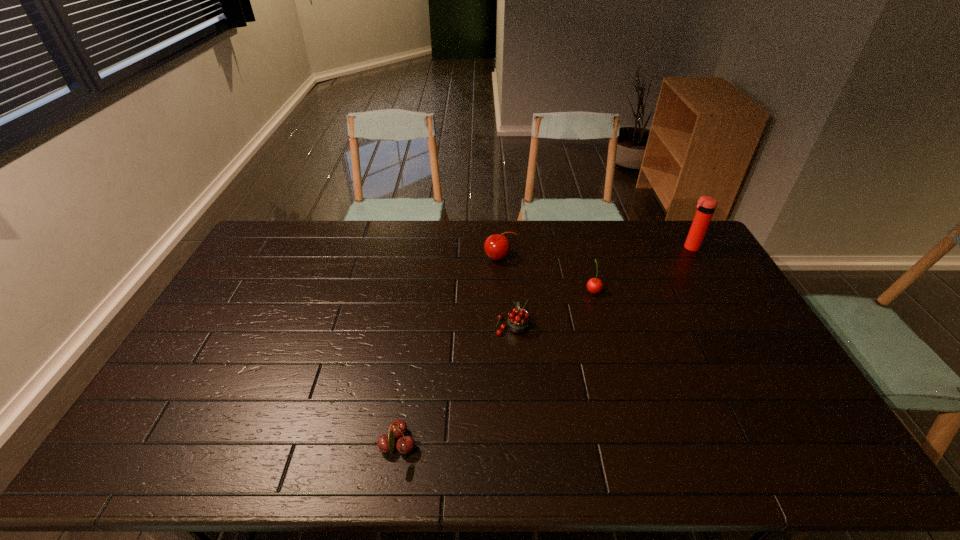
Identify the location of the rightmost object. The image size is (960, 540). (706, 205).

Locate an element on the screen. This screenshot has width=960, height=540. the tallest object is located at coordinates (706, 205).

You are a GUI agent. You are given a task and a screenshot of the screen. Output one action in this format:
    pyautogui.click(x=<x>, y=<y>)
    Task: Click on the farthest cherry
    
    Given the screenshot: What is the action you would take?
    pyautogui.click(x=497, y=246)

The height and width of the screenshot is (540, 960). I want to click on the third nearest object, so click(594, 285).

Where is `the second farthest cherry`? The width and height of the screenshot is (960, 540). the second farthest cherry is located at coordinates (594, 285).

The width and height of the screenshot is (960, 540). What are the coordinates of `the fourth farthest object` in the screenshot? It's located at (518, 319).

The image size is (960, 540). I want to click on the leftmost object, so click(x=386, y=443).

The image size is (960, 540). In order to click on the nearest cherry in this screenshot , I will do `click(386, 443)`.

Where is `vacant space located 0.050m on the front of the thermos bottle`? The height and width of the screenshot is (540, 960). vacant space located 0.050m on the front of the thermos bottle is located at coordinates (698, 260).

The image size is (960, 540). In order to click on free space located on the front of the farthest cherry in this screenshot , I will do 503,330.